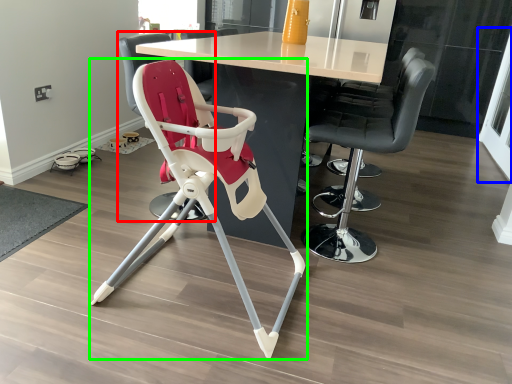
Question: Which object is positioned closest to chair (highlighted by a red box)? Select from screen door (highlighted by a blue box) and chair (highlighted by a green box).

Choices:
 (A) screen door
 (B) chair

Answer: (B)